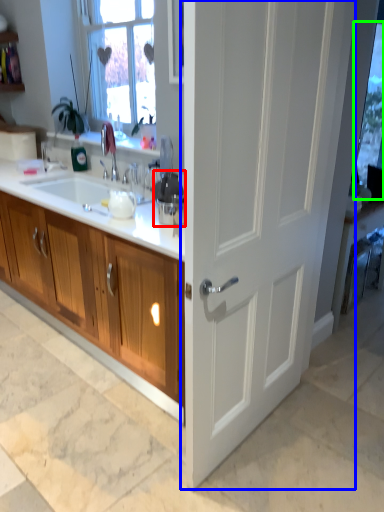
Question: Which object is positioned closest to appliance (highlighted by a red box)? Select from door (highlighted by a blue box) and window screen (highlighted by a green box).

Choices:
 (A) door
 (B) window screen

Answer: (A)